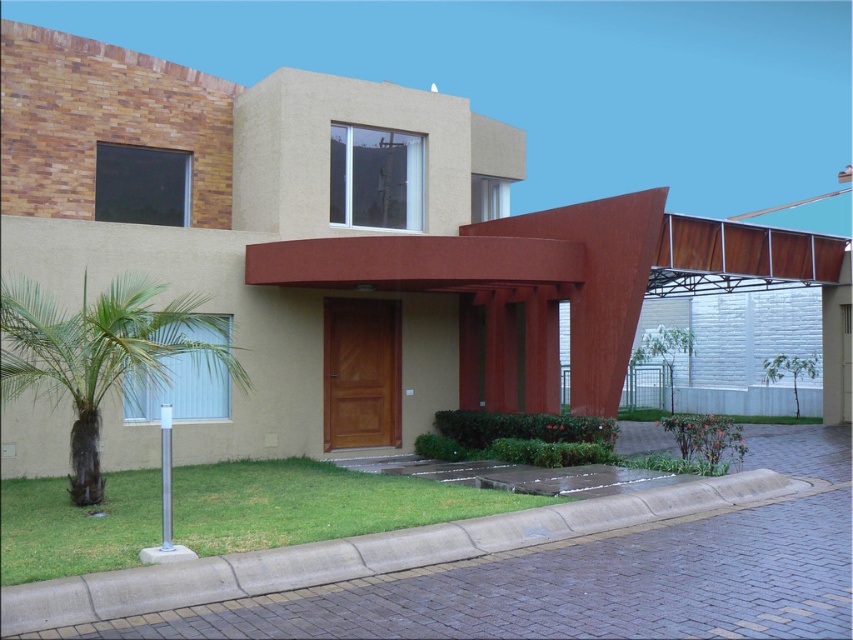
Question: Among these points, which one is farthest from the camera?

Choices:
 (A) (218, 513)
 (B) (434, 557)
 (C) (4, 298)

Answer: (A)

Question: Is green grass at lower center to the right of green leafy palm tree at lower left from the viewer's perspective?

Choices:
 (A) no
 (B) yes

Answer: (B)

Question: Among these points, which one is farthest from the camera?

Choices:
 (A) (32, 602)
 (B) (131, 337)
 (C) (436, 492)

Answer: (C)

Question: Is green grass at lower center behind green leafy palm tree at lower left?

Choices:
 (A) yes
 (B) no

Answer: (B)

Question: Which object is closer to the camera taking this photo?

Choices:
 (A) gray concrete curb at lower center
 (B) green grass at lower center

Answer: (A)

Question: Does green grass at lower center lie behind gray concrete curb at lower center?

Choices:
 (A) no
 (B) yes

Answer: (B)